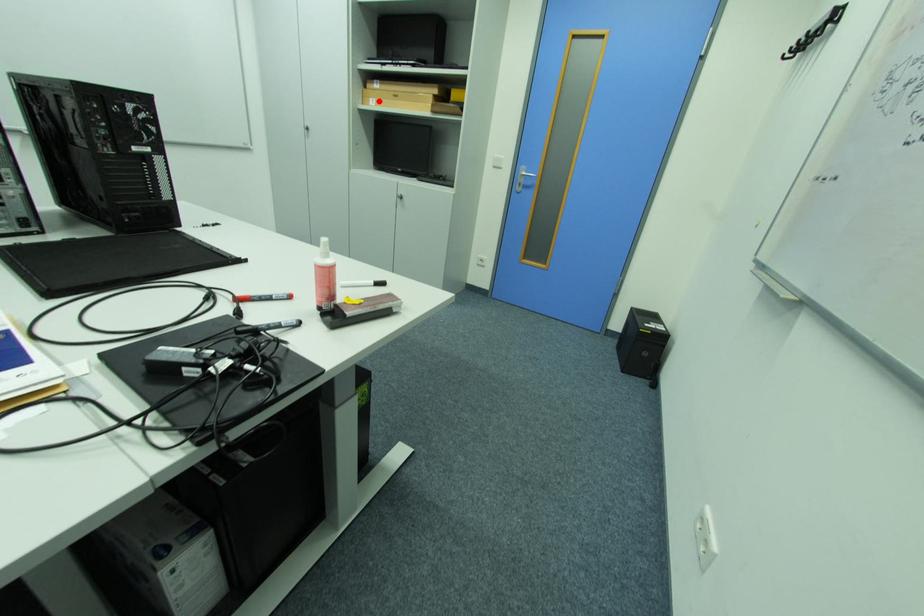
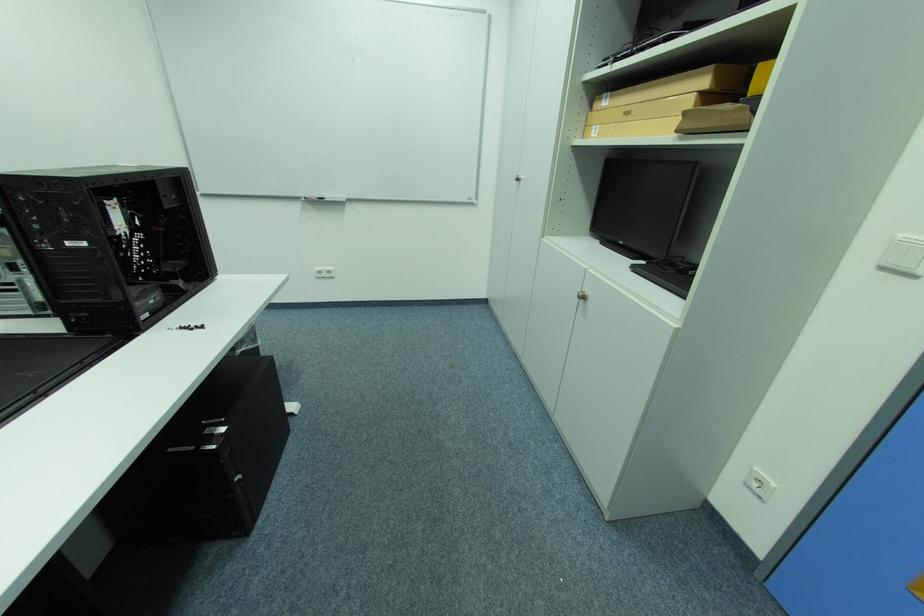
Question: I am providing you with two images of the same scene from different viewpoints. A red point is marked on the first image. Is the red point's position out of view in image 2?

Choices:
 (A) Yes
 (B) No

Answer: (B)